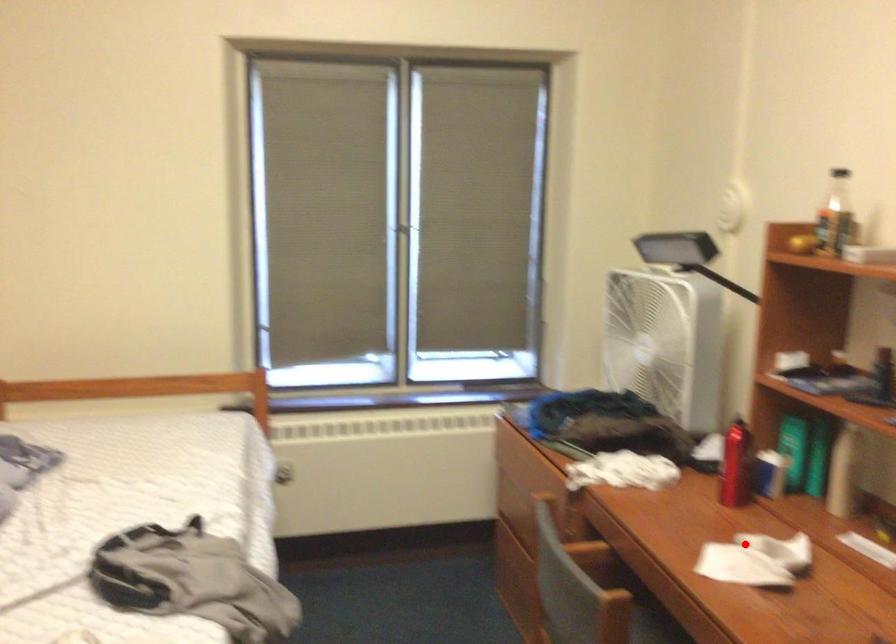
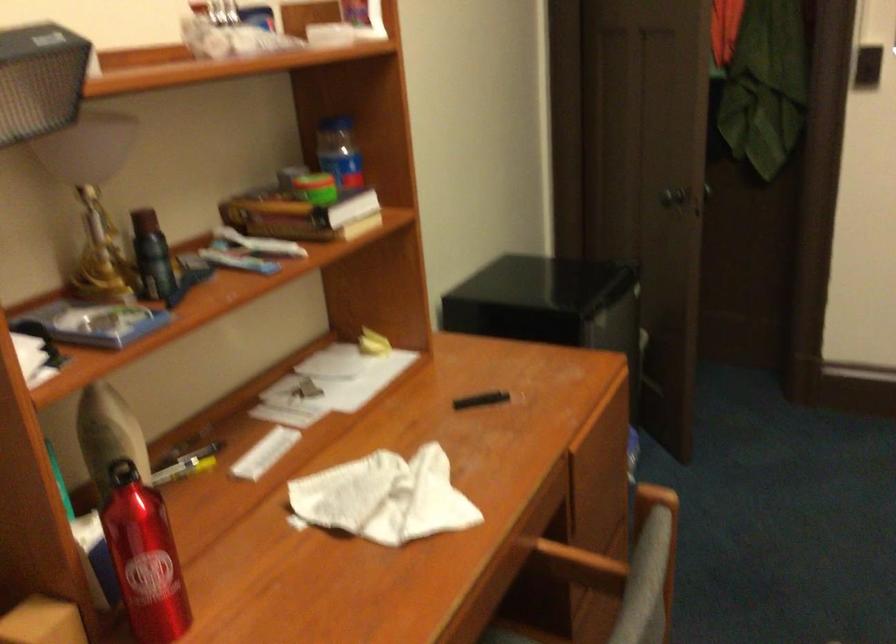
Question: A red point is marked in image1. In image2, is the corresponding 3D point closer to the camera or farther? Reply with the corresponding letter.

Choices:
 (A) The corresponding 3D point is closer.
 (B) The corresponding 3D point is farther.

Answer: (A)